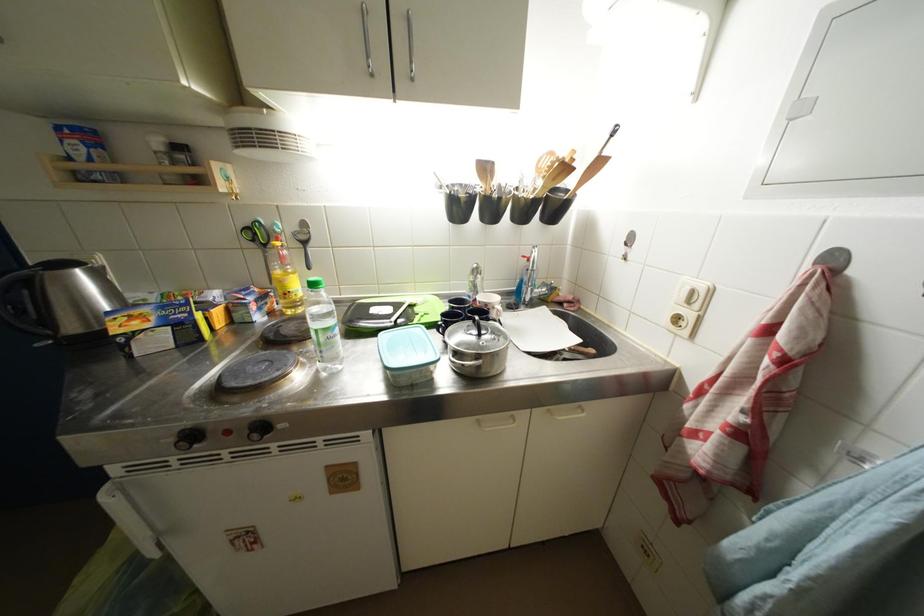
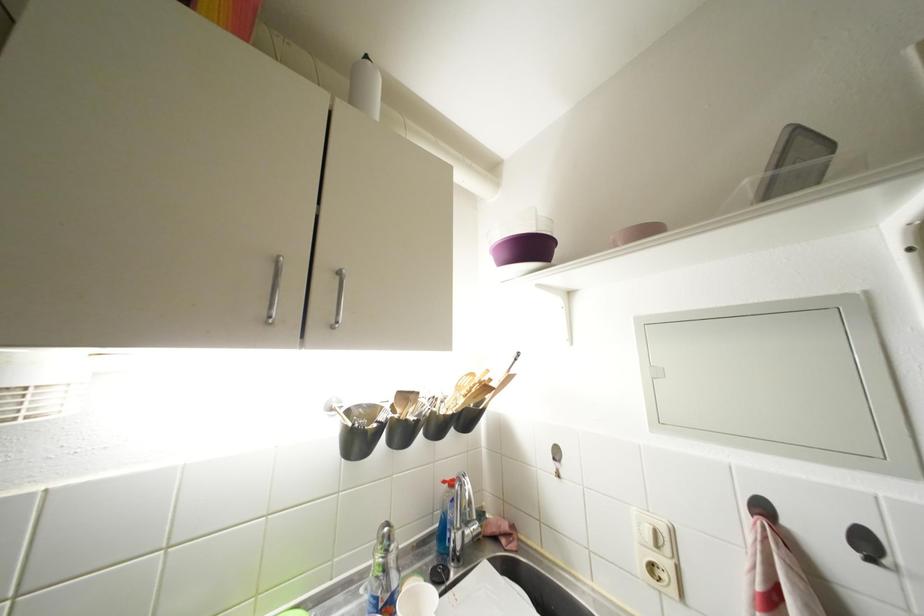
Find the pixel in the second image that matches point (558, 156) in the first image.

(479, 379)